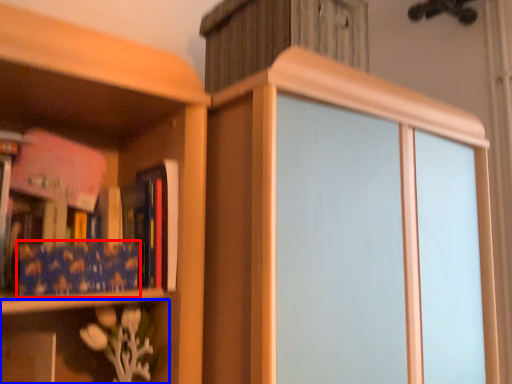
Question: Which object is closer to the camera taking this photo, paperback book (highlighted by a red box) or shelf (highlighted by a blue box)?

Choices:
 (A) paperback book
 (B) shelf

Answer: (B)